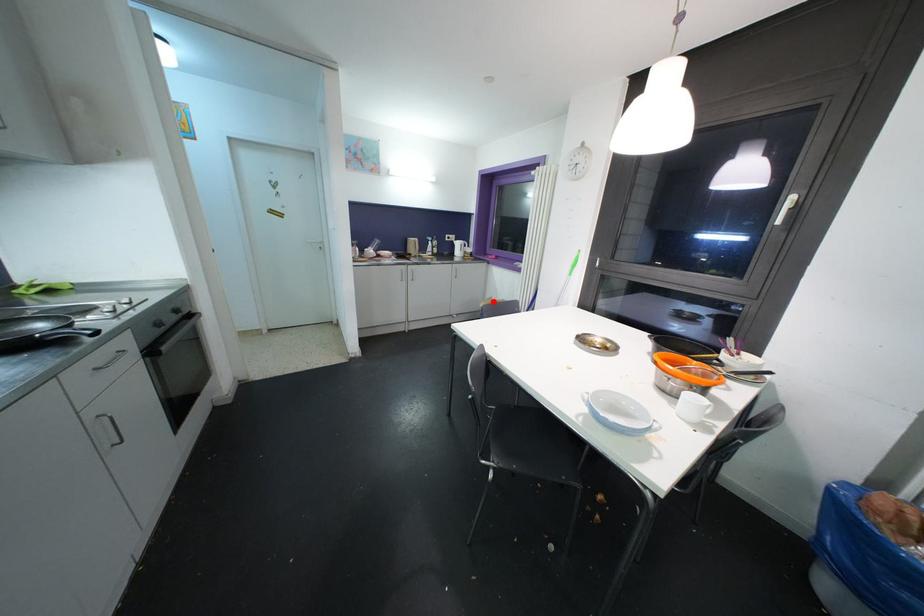
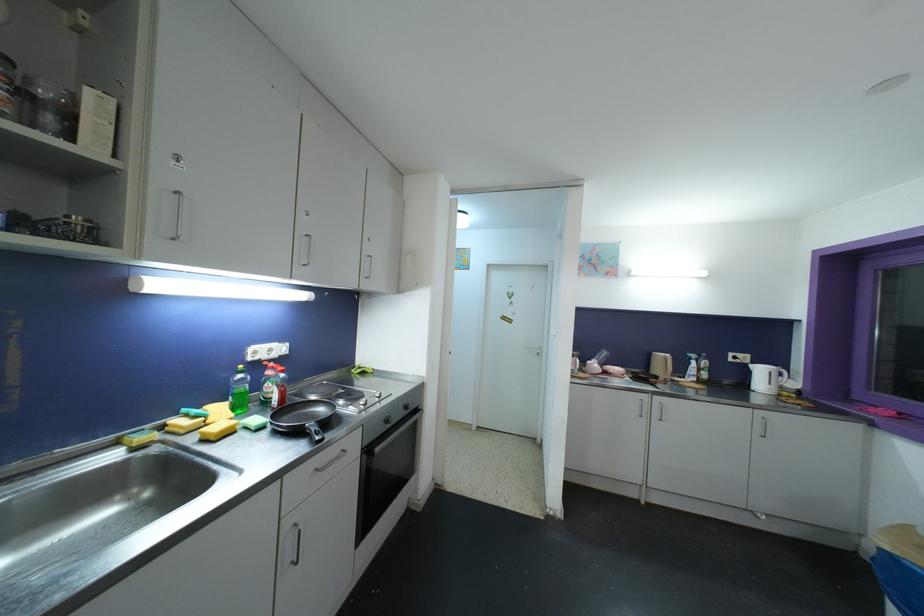
Find the pixel in the second image that matches the highlighted location in the first image.

(912, 532)